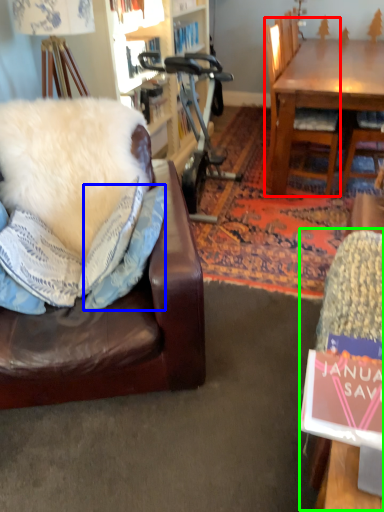
Question: Which object is positioned closest to chair (highlighted by a red box)? Select from pillow (highlighted by a blue box) and swivel chair (highlighted by a green box).

Choices:
 (A) pillow
 (B) swivel chair

Answer: (A)